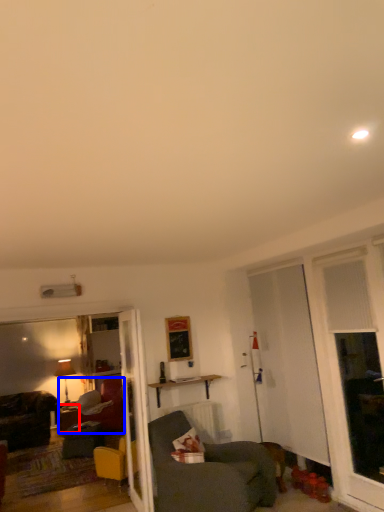
Question: Which of the following is the closest to the observer, desk (highlighted by a red box) or studio couch (highlighted by a blue box)?

Choices:
 (A) desk
 (B) studio couch

Answer: (B)